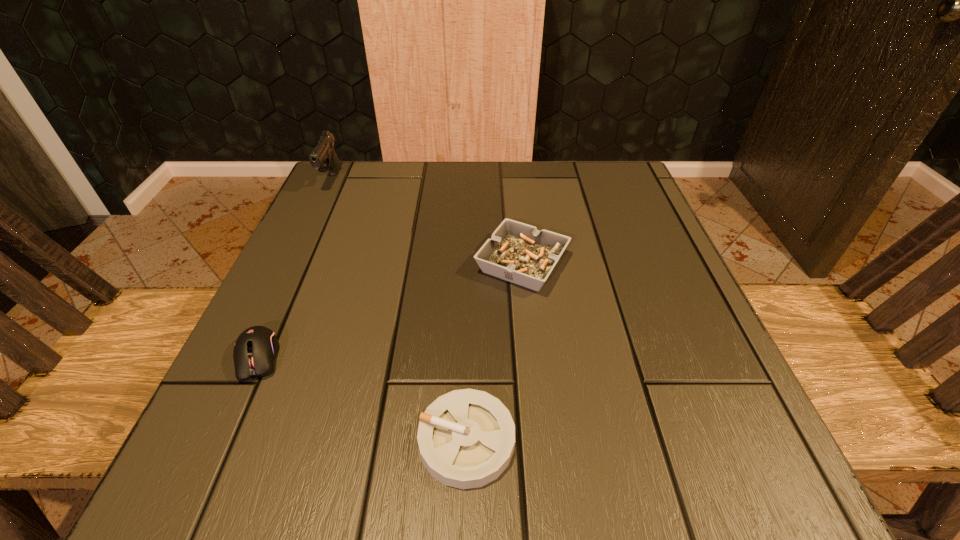
Identify the location of vacant space at the far left corner. (370, 217).

Identify the location of vacant space at the near left corner of the desktop. (209, 460).

Where is `free space at the near right corner of the desktop`? Image resolution: width=960 pixels, height=540 pixels. free space at the near right corner of the desktop is located at coordinates (689, 436).

Find the location of a particular element. Image resolution: width=960 pixels, height=540 pixels. empty space between the tallest object and the shortest object is located at coordinates (399, 310).

At what (x,y) coordinates should I click in order to perform the action: click on vacant area that lies between the third nearest object and the computer mouse. Please return your answer as a coordinate pair (x, y). This screenshot has height=540, width=960. Looking at the image, I should click on (391, 310).

Where is `empty space that is in between the third nearest object and the farthest object`? empty space that is in between the third nearest object and the farthest object is located at coordinates (427, 222).

The image size is (960, 540). Find the location of `empty space between the third farthest object and the farther ashtray`. empty space between the third farthest object and the farther ashtray is located at coordinates (391, 310).

Locate an element on the screen. This screenshot has width=960, height=540. vacant space in between the nearest object and the second farthest object is located at coordinates (494, 352).

Where is `free space between the nearer ashtray and the third farthest object`? free space between the nearer ashtray and the third farthest object is located at coordinates (363, 399).

Image resolution: width=960 pixels, height=540 pixels. Identify the location of vacant area that lies between the second nearest object and the third nearest object. (391, 310).